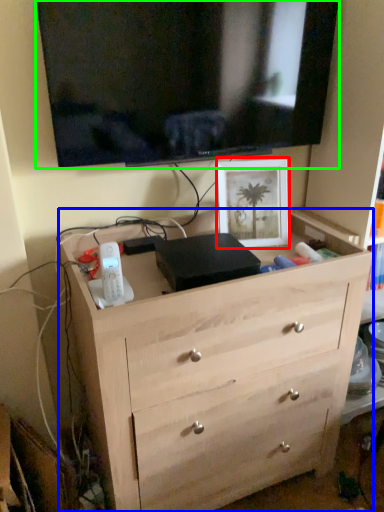
Question: Which object is the closest to the picture frame (highlighted by a red box)? Choose among these: chest of drawers (highlighted by a blue box) or television (highlighted by a green box).

Choices:
 (A) chest of drawers
 (B) television

Answer: (B)